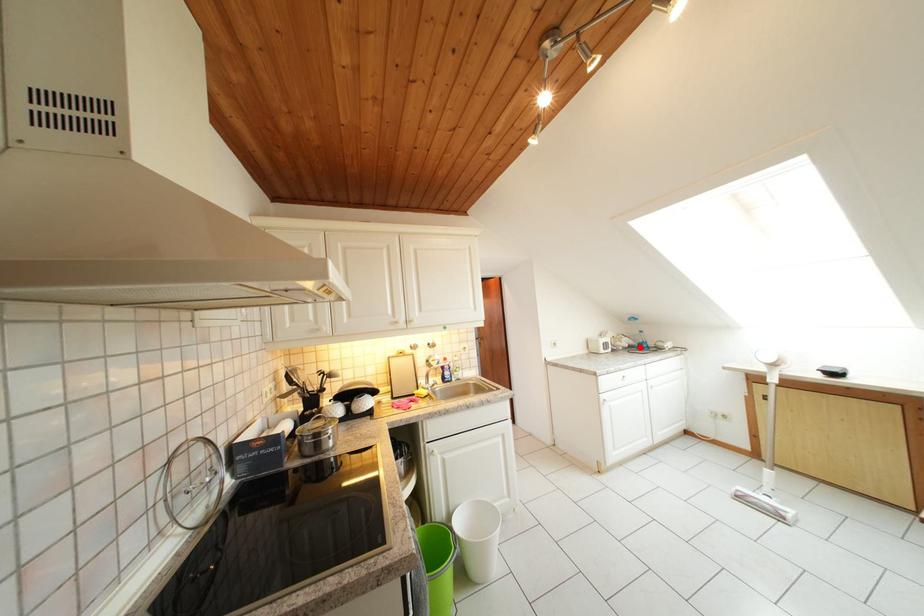
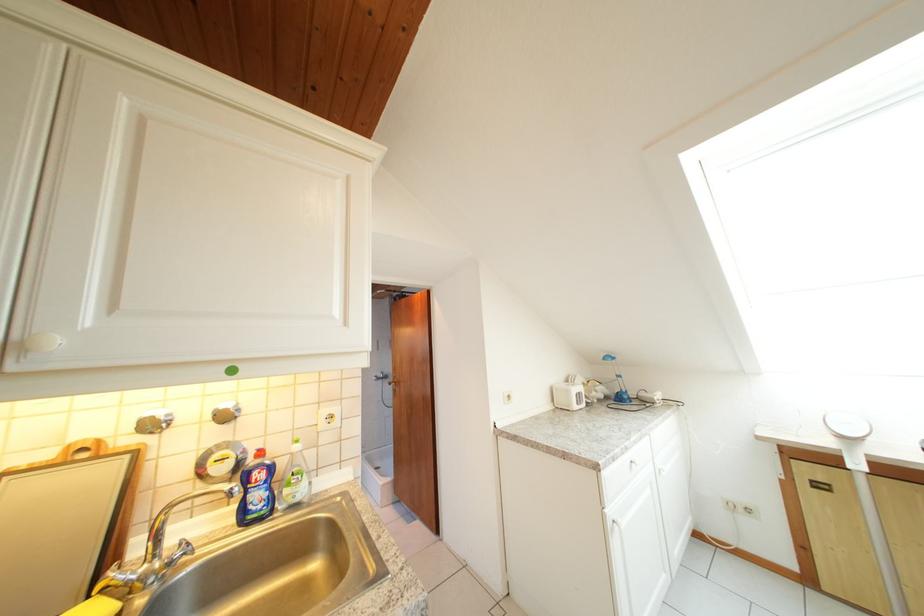
In the second image, find the point that corresponds to the highlighted location in the first image.

(614, 397)